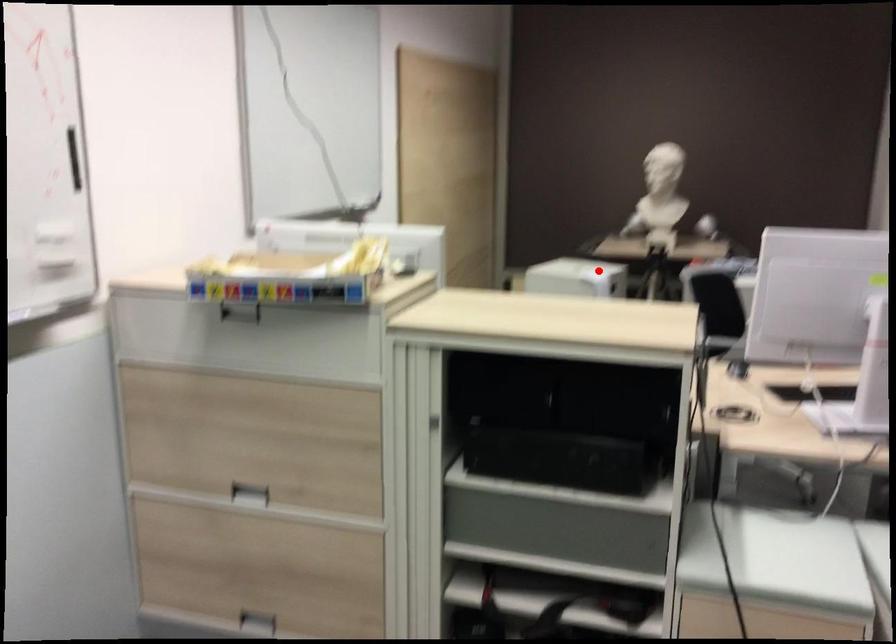
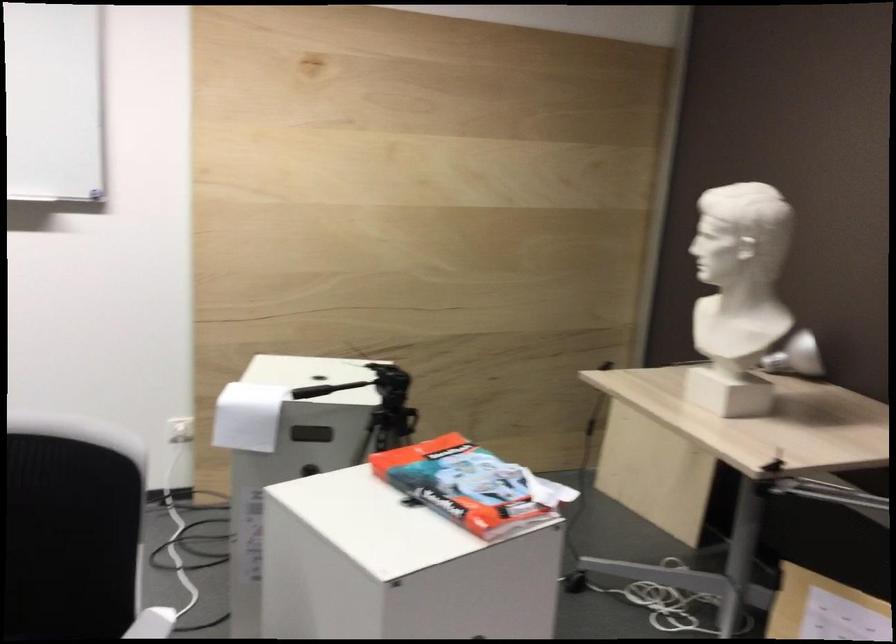
Question: A red point is marked in image1. In image2, is the corresponding 3D point closer to the camera or farther? Reply with the corresponding letter.

Choices:
 (A) The corresponding 3D point is closer.
 (B) The corresponding 3D point is farther.

Answer: (A)